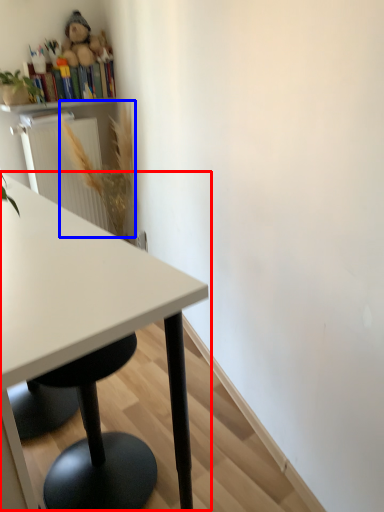
Question: Which object appears closest to the camera in this image, table (highlighted by a red box) or flower (highlighted by a blue box)?

Choices:
 (A) table
 (B) flower

Answer: (A)